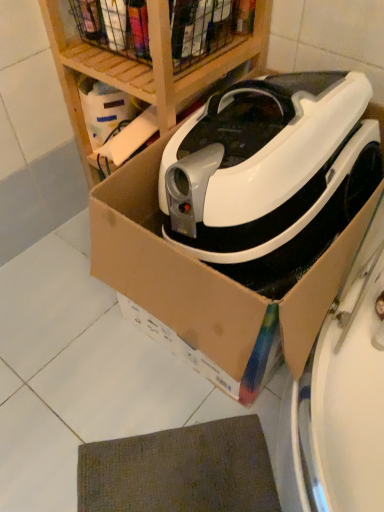
Question: From the image's perspective, does cardboard box at center appear higher than brown textured mat at lower center?

Choices:
 (A) no
 (B) yes

Answer: (B)

Question: From a real-world perspective, does cardboard box at center stand above brown textured mat at lower center?

Choices:
 (A) no
 (B) yes

Answer: (B)

Question: Can you confirm if cardboard box at center is thinner than brown textured mat at lower center?

Choices:
 (A) no
 (B) yes

Answer: (A)

Question: Can you confirm if cardboard box at center is positioned to the left of brown textured mat at lower center?

Choices:
 (A) yes
 (B) no

Answer: (B)

Question: Considering the relative sizes of cardboard box at center and brown textured mat at lower center in the image provided, is cardboard box at center shorter than brown textured mat at lower center?

Choices:
 (A) yes
 (B) no

Answer: (B)

Question: Relative to wooden at upper center, is cardboard box at center in front or behind?

Choices:
 (A) front
 (B) behind

Answer: (A)

Question: From the image's perspective, is cardboard box at center located above or below wooden at upper center?

Choices:
 (A) above
 (B) below

Answer: (B)

Question: Considering the positions of point (253, 353) and point (130, 65), is point (253, 353) closer or farther from the camera than point (130, 65)?

Choices:
 (A) closer
 (B) farther

Answer: (A)

Question: Which is correct: cardboard box at center is inside wooden at upper center, or outside of it?

Choices:
 (A) inside
 (B) outside

Answer: (B)

Question: Is white glossy robotic vacuum cleaner at center in front of or behind cardboard box at center in the image?

Choices:
 (A) behind
 (B) front

Answer: (A)

Question: From the image's perspective, is white glossy robotic vacuum cleaner at center located above or below cardboard box at center?

Choices:
 (A) below
 (B) above

Answer: (B)

Question: Considering the relative positions of white glossy robotic vacuum cleaner at center and cardboard box at center in the image provided, is white glossy robotic vacuum cleaner at center to the left or to the right of cardboard box at center?

Choices:
 (A) left
 (B) right

Answer: (A)

Question: Is white glossy robotic vacuum cleaner at center wider or thinner than cardboard box at center?

Choices:
 (A) wide
 (B) thin

Answer: (B)

Question: In terms of size, does wooden at upper center appear bigger or smaller than white glossy robotic vacuum cleaner at center?

Choices:
 (A) big
 (B) small

Answer: (A)

Question: Is wooden at upper center inside the boundaries of white glossy robotic vacuum cleaner at center, or outside?

Choices:
 (A) outside
 (B) inside

Answer: (A)